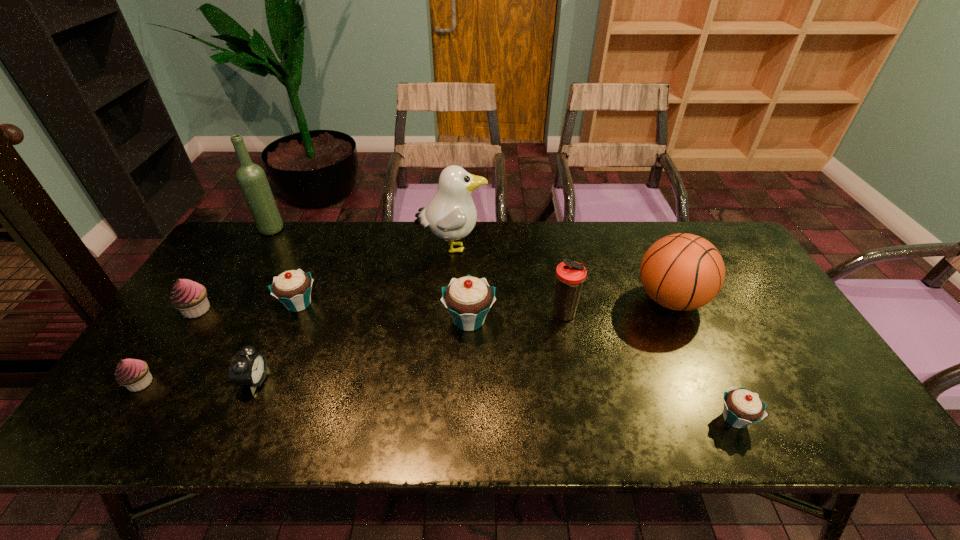
Where is `green wine bottle`? green wine bottle is located at coordinates (252, 179).

The height and width of the screenshot is (540, 960). What are the coordinates of `gull` in the screenshot? It's located at (451, 214).

At what (x,y) coordinates should I click in order to perform the action: click on white gull. Please return your answer as a coordinate pair (x, y). The height and width of the screenshot is (540, 960). Looking at the image, I should click on (451, 214).

Identify the location of basketball. The image size is (960, 540). (682, 271).

The height and width of the screenshot is (540, 960). Identify the location of the third object from right to left. (570, 275).

Find the location of a particular element. This screenshot has width=960, height=540. brown thermos bottle is located at coordinates (570, 275).

This screenshot has height=540, width=960. I want to click on the second teal cupcake from left to right, so click(x=468, y=299).

This screenshot has height=540, width=960. In order to click on the sixth shortest object in this screenshot , I will do `click(468, 299)`.

Locate an element on the screen. the third cupcake from right to left is located at coordinates (292, 288).

Where is `the second smallest teal cupcake`? The image size is (960, 540). the second smallest teal cupcake is located at coordinates (292, 288).